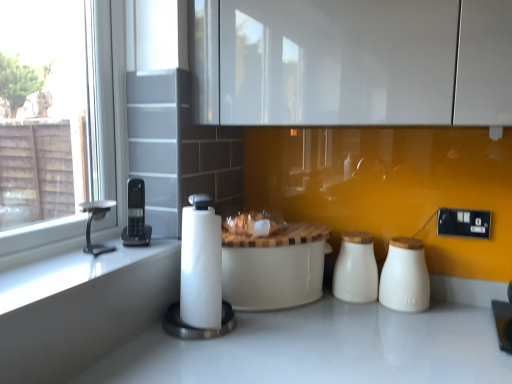
Question: Considering the relative positions of translucent plastic bag at center and white paper towel at center, the first appliance viewed from the right, in the image provided, is translucent plastic bag at center to the left or to the right of white paper towel at center, the first appliance viewed from the right,?

Choices:
 (A) left
 (B) right

Answer: (B)

Question: Do you think translucent plastic bag at center is within white paper towel at center, the 2th appliance when ordered from left to right, or outside of it?

Choices:
 (A) inside
 (B) outside

Answer: (B)

Question: Which is farther from the black plastic electrical outlet at right?

Choices:
 (A) white paper towel at center, the 2th appliance when ordered from left to right
 (B) white ceramic salt shaker at right, which appears as the first salt shaker when viewed from the right
 (C) white ceramic table at center
 (D) white ceramic salt shaker at center, marked as the first salt shaker in a left-to-right arrangement
 (E) translucent plastic bag at center

Answer: (A)

Question: Which is nearer to the black plastic phone at left, the 1th appliance positioned from the left?

Choices:
 (A) black plastic electrical outlet at right
 (B) white ceramic salt shaker at center, the 2th salt shaker when ordered from right to left
 (C) silver metallic faucet at left
 (D) white paper towel at center, the 2th appliance when ordered from left to right
 (E) white ceramic table at center

Answer: (C)